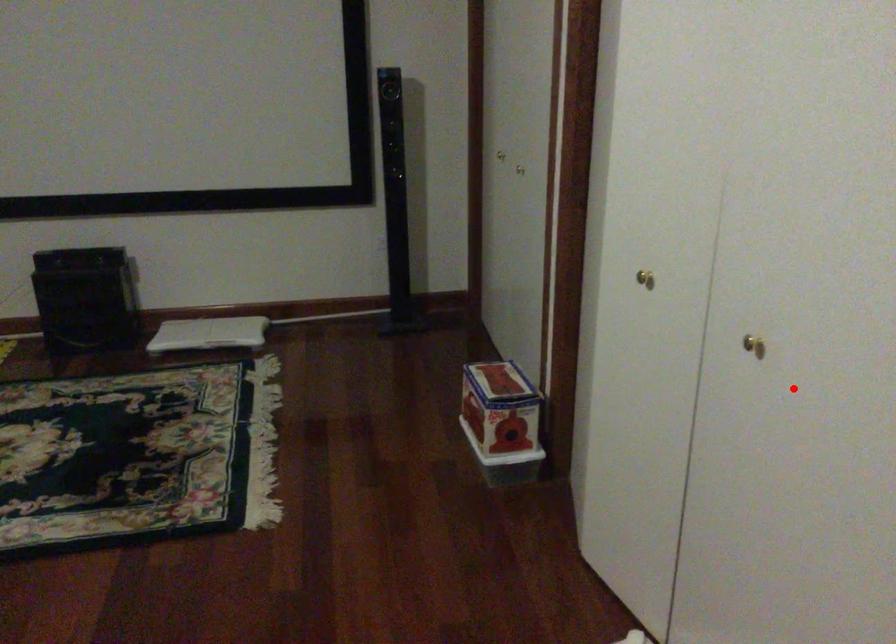
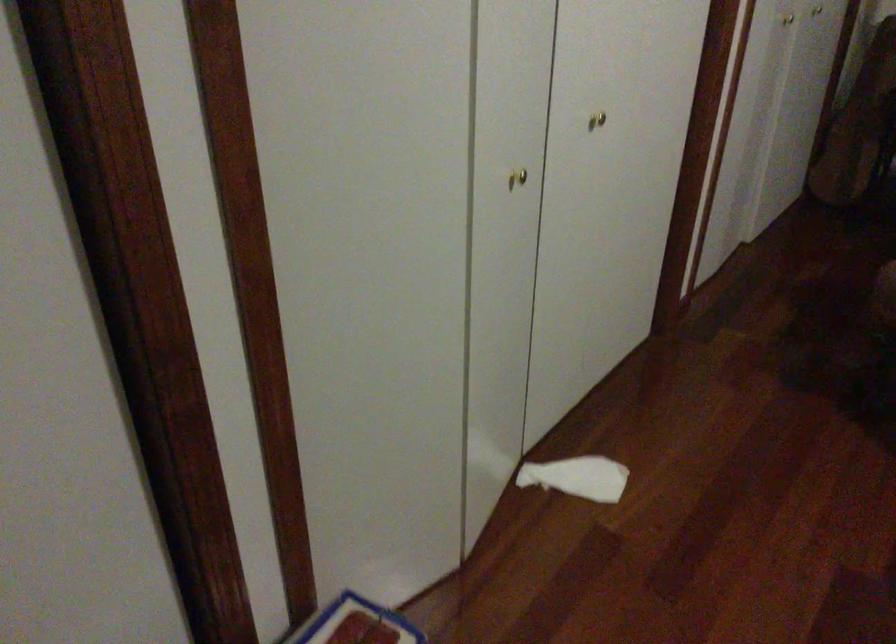
Question: I am providing you with two images of the same scene from different viewpoints. In image1, a red point is highlighted. Considering the same 3D point in image2, which of the following is correct?

Choices:
 (A) It is closer
 (B) It is farther

Answer: (B)